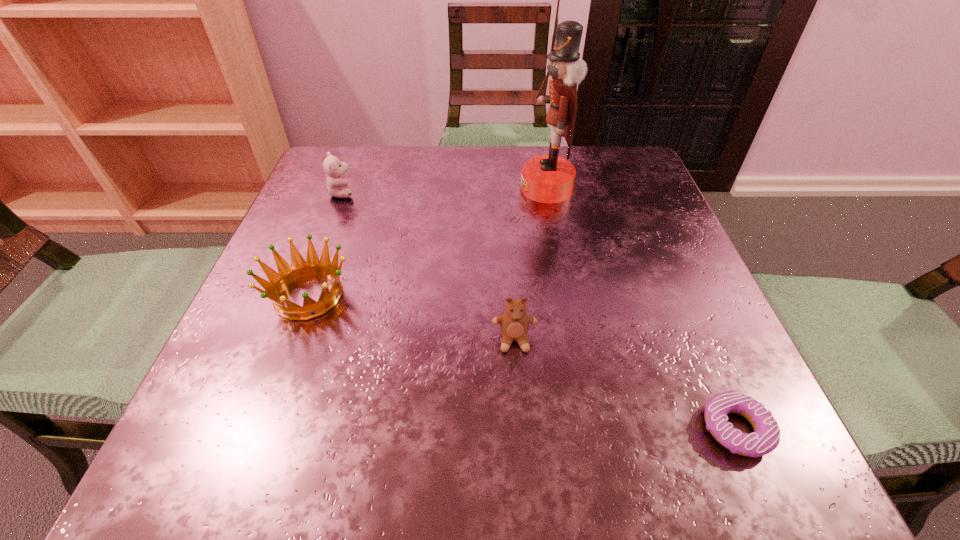
Identify the location of blank region between the crown and the nearer teddy bear. This screenshot has height=540, width=960. (412, 318).

Locate an element on the screen. The image size is (960, 540). vacant point located between the crown and the fourth object from left to right is located at coordinates (427, 242).

This screenshot has width=960, height=540. Identify the location of empty space between the nearer teddy bear and the shortest object. (625, 384).

Where is `vacant area that lies between the farther teddy bear and the nearest object`? This screenshot has height=540, width=960. vacant area that lies between the farther teddy bear and the nearest object is located at coordinates (539, 310).

The height and width of the screenshot is (540, 960). Identify the location of unoccupied position between the farther teddy bear and the nutcracker. (444, 191).

Image resolution: width=960 pixels, height=540 pixels. I want to click on unoccupied position between the nearest object and the farther teddy bear, so click(x=539, y=310).

Locate an element on the screen. The image size is (960, 540). free space between the left teddy bear and the nearest object is located at coordinates (539, 310).

Point out which object is positioned as the fourth nearest to the crown. Please provide its 2D coordinates. Your answer should be formatted as a tuple, i.e. [(x, y)], where the tuple contains the x and y coordinates of a point satisfying the conditions above.

[(766, 436)]

The width and height of the screenshot is (960, 540). Find the location of `object that stands as the fourth closest to the right teddy bear`. object that stands as the fourth closest to the right teddy bear is located at coordinates coord(335,170).

Locate an element on the screen. The image size is (960, 540). free point that satisfies the following two spatial constraints: 1. on the front-facing side of the fourth object from left to right; 2. on the back side of the rightmost object is located at coordinates (592, 428).